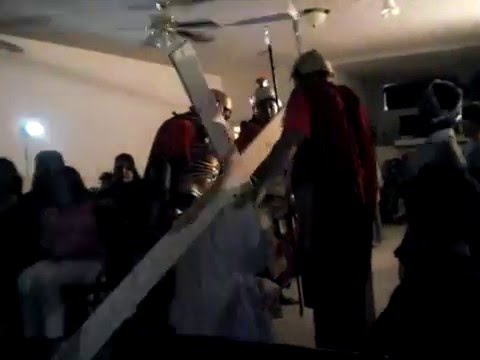
This screenshot has height=360, width=480. Find the location of `ceiling`. ceiling is located at coordinates (328, 34).